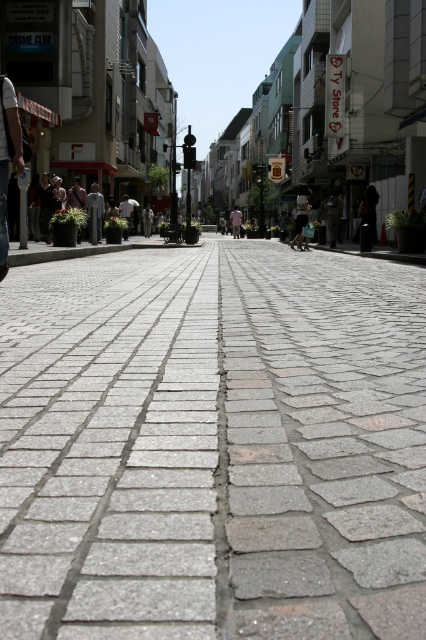
Is light blue denim jacket at center shorter than light pink shirt at center?

Yes.

Is point (299, 186) farther from camera compared to point (233, 216)?

No, (299, 186) is closer to viewer.

At what (x,y) coordinates should I click in order to perform the action: click on light blue denim jacket at center. Please return your answer as a coordinate pair (x, y). Image resolution: width=426 pixels, height=640 pixels. Looking at the image, I should click on (301, 214).

Is gray cobblestone pavement at center taller than light blue denim jacket at center?

No, gray cobblestone pavement at center is not taller than light blue denim jacket at center.

The width and height of the screenshot is (426, 640). Identify the location of gray cobblestone pavement at center. (213, 445).

Who is more forward, (304, 340) or (299, 209)?

Point (304, 340) is in front.

You are a GUI agent. You are given a task and a screenshot of the screen. Output one action in this format:
    pyautogui.click(x=<x>, y=<y>)
    Task: Click on the gray cobblestone pavement at center
    Image resolution: width=426 pixels, height=640 pixels.
    Given the screenshot: What is the action you would take?
    pyautogui.click(x=213, y=445)

Can you confirm if gray cobblestone pavement at center is smaller than light pink shirt at center?

Indeed, gray cobblestone pavement at center has a smaller size compared to light pink shirt at center.

Can you confirm if gray cobblestone pavement at center is taller than light pink shirt at center?

In fact, gray cobblestone pavement at center may be shorter than light pink shirt at center.

The image size is (426, 640). I want to click on gray cobblestone pavement at center, so click(213, 445).